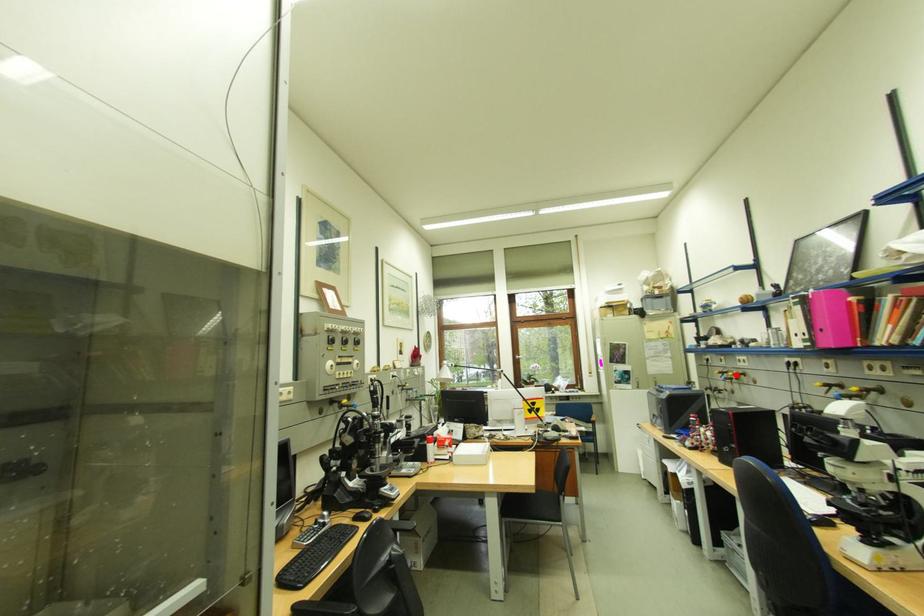
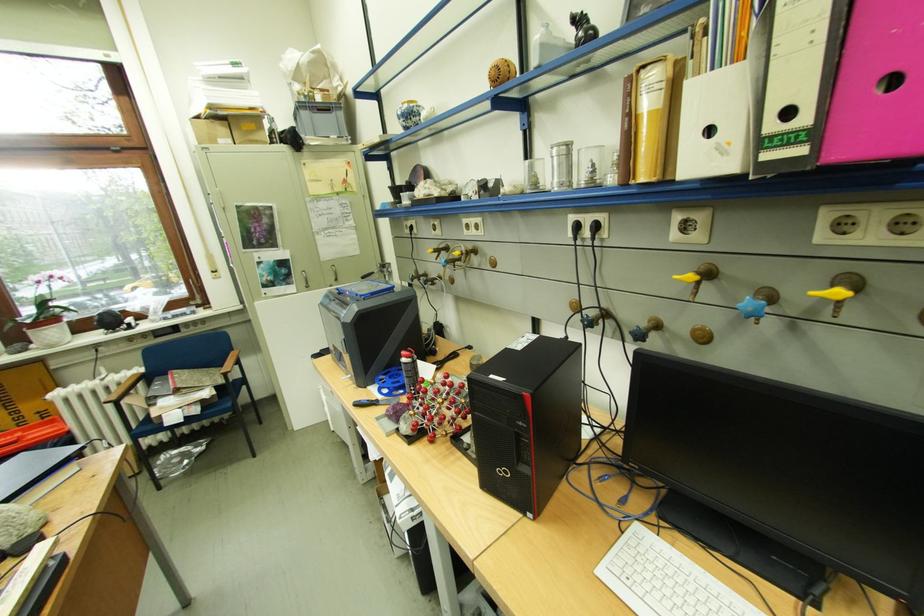
In the second image, find the point that corresponds to the highlighted location in the first image.

(453, 253)